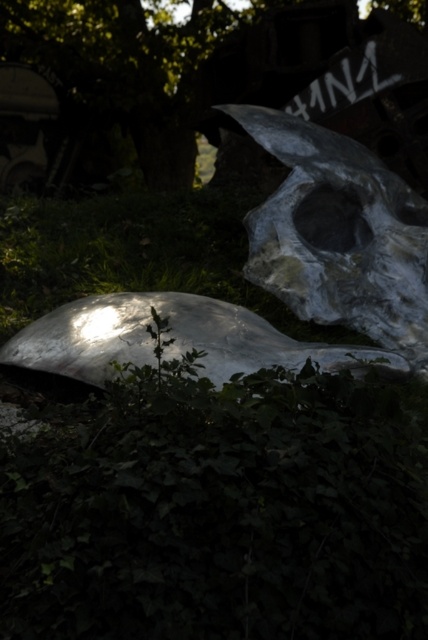
Is point (305, 26) behind point (386, 230)?

Yes, point (305, 26) is behind point (386, 230).

Is green leafy tree at center to the right of metallic gray skull at upper right from the viewer's perspective?

No, green leafy tree at center is not to the right of metallic gray skull at upper right.

Between point (374, 129) and point (416, 353), which one is positioned behind?

The point (374, 129) is behind.

You are a GUI agent. You are given a task and a screenshot of the screen. Output one action in this format:
    pyautogui.click(x=<x>, y=<y>)
    Task: Click on the green leafy tree at center
    The width and height of the screenshot is (428, 640).
    Given the screenshot: What is the action you would take?
    pyautogui.click(x=222, y=74)